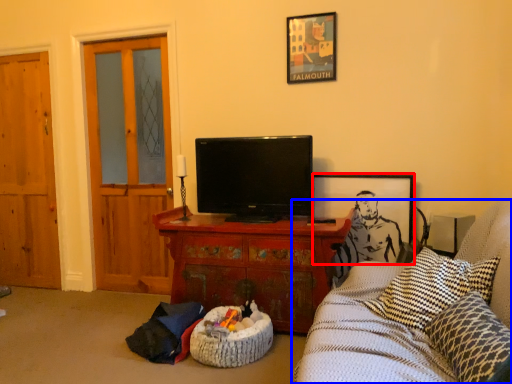
Question: Which of the following is the closest to the observer, picture frame (highlighted by a red box) or studio couch (highlighted by a blue box)?

Choices:
 (A) picture frame
 (B) studio couch

Answer: (B)